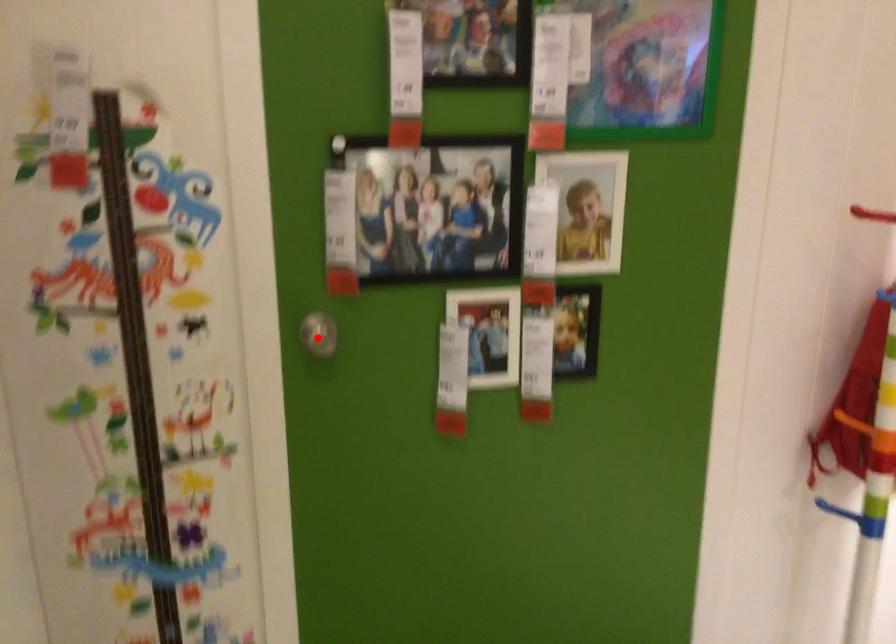
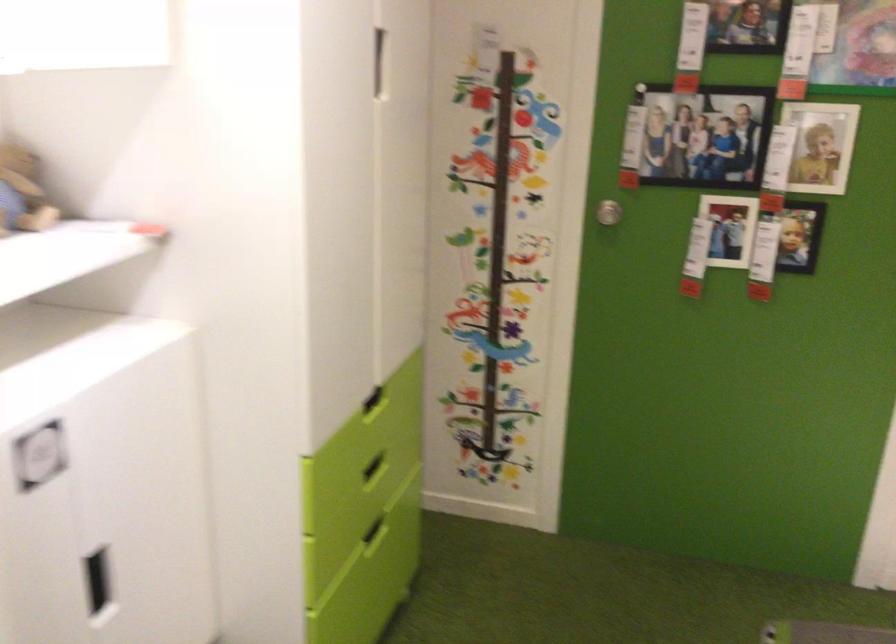
Where in the second image is the point corresponding to the highlighted location from the first image?

(607, 212)